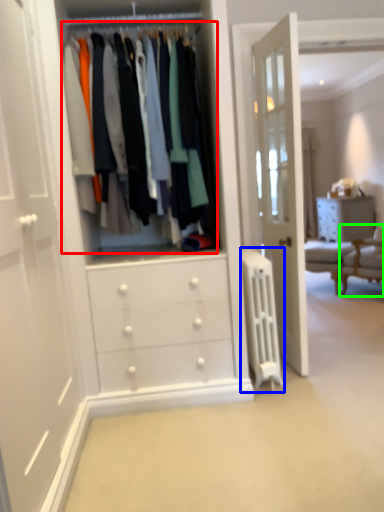
Question: Which object is the closest to the closet (highlighted by a red box)? Choose among these: wide (highlighted by a blue box) or furniture (highlighted by a green box).

Choices:
 (A) wide
 (B) furniture

Answer: (A)